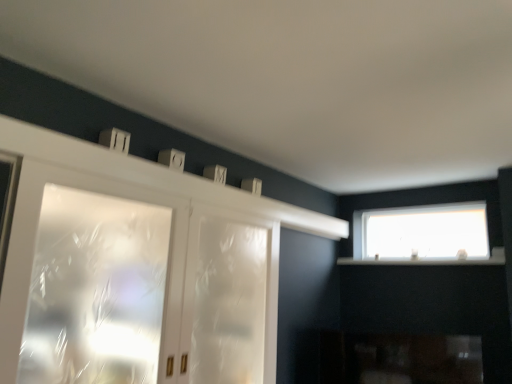
Question: Is transparent plastic screen door at center positioned before white matte mantle at upper center?

Choices:
 (A) yes
 (B) no

Answer: (B)

Question: Considering the relative sizes of transparent plastic screen door at center and white matte mantle at upper center in the image provided, is transparent plastic screen door at center smaller than white matte mantle at upper center?

Choices:
 (A) no
 (B) yes

Answer: (A)

Question: Is transparent plastic screen door at center located outside white matte mantle at upper center?

Choices:
 (A) no
 (B) yes

Answer: (B)

Question: Does transparent plastic screen door at center have a lesser height compared to white matte mantle at upper center?

Choices:
 (A) yes
 (B) no

Answer: (B)

Question: Is transparent plastic screen door at center to the left of white matte mantle at upper center from the viewer's perspective?

Choices:
 (A) yes
 (B) no

Answer: (A)

Question: Is transparent plastic screen door at center behind white matte mantle at upper center?

Choices:
 (A) no
 (B) yes

Answer: (B)

Question: Is transparent glass window at upper right, which is the 1th window from back to front, with white matte mantle at upper center?

Choices:
 (A) yes
 (B) no

Answer: (B)

Question: Is transparent glass window at upper right, the first window from the right, taller than white matte mantle at upper center?

Choices:
 (A) yes
 (B) no

Answer: (A)

Question: Is transparent glass window at upper right, which is the 1th window from back to front, further to camera compared to white matte mantle at upper center?

Choices:
 (A) yes
 (B) no

Answer: (A)

Question: From a real-world perspective, is transparent glass window at upper right, the first window from the right, under white matte mantle at upper center?

Choices:
 (A) yes
 (B) no

Answer: (A)

Question: Can you confirm if transparent glass window at upper right, which is the 1th window from back to front, is smaller than white matte mantle at upper center?

Choices:
 (A) no
 (B) yes

Answer: (B)

Question: Does transparent glass window at upper right, which is the 1th window from back to front, have a lesser height compared to white matte mantle at upper center?

Choices:
 (A) yes
 (B) no

Answer: (B)

Question: Considering the relative sizes of transparent plastic screen door at center and frosted glass cabinet at left, the 2th window positioned from the right, in the image provided, is transparent plastic screen door at center wider than frosted glass cabinet at left, the 2th window positioned from the right,?

Choices:
 (A) no
 (B) yes

Answer: (A)